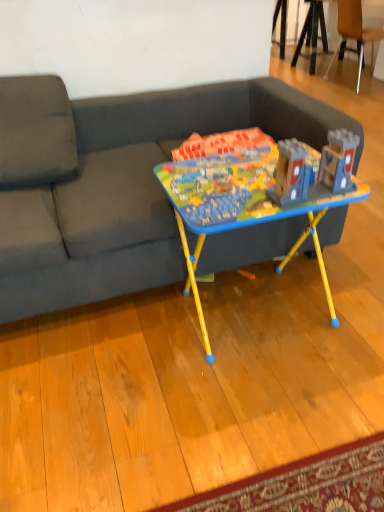
This screenshot has width=384, height=512. Identify the location of vacant region to the left of matte plastic table at center. (119, 344).